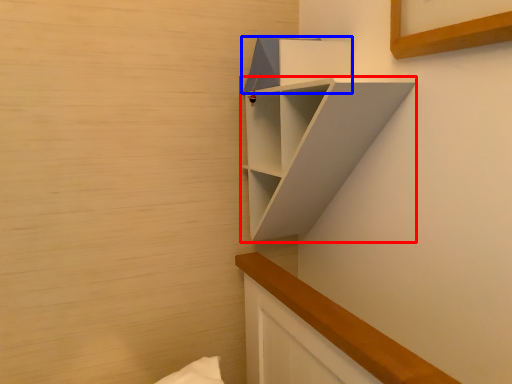
Question: Among these objects, which one is farthest to the camera, shelf (highlighted by a red box) or cabinet (highlighted by a blue box)?

Choices:
 (A) shelf
 (B) cabinet

Answer: (B)